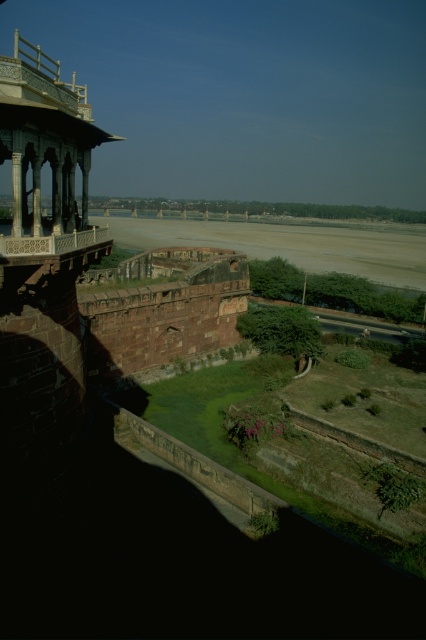
Question: Which of the following is the closest to the observer?

Choices:
 (A) (347, 230)
 (B) (6, 140)
 (C) (215, 316)

Answer: (B)

Question: Is reddish-brown stone wall at center behind white marble gazebo at upper left?

Choices:
 (A) yes
 (B) no

Answer: (A)

Question: Observing the image, what is the correct spatial positioning of reddish-brown stone wall at center in reference to white marble gazebo at upper left?

Choices:
 (A) right
 (B) left

Answer: (A)

Question: Which object is farther from the camera taking this photo?

Choices:
 (A) white marble gazebo at upper left
 (B) reddish-brown stone wall at center

Answer: (B)

Question: Does white marble gazebo at upper left have a larger size compared to smooth stone balcony at upper left?

Choices:
 (A) no
 (B) yes

Answer: (B)

Question: Which object appears closest to the camera in this image?

Choices:
 (A) brown stone wall at center
 (B) white marble gazebo at upper left
 (C) reddish-brown stone wall at center

Answer: (B)